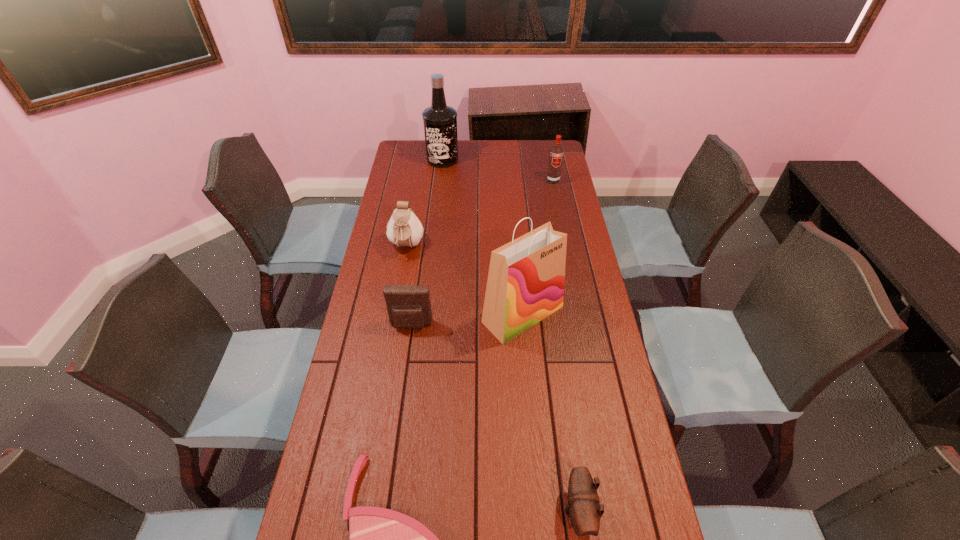
The height and width of the screenshot is (540, 960). Identify the location of vacant space at the far right corner of the desktop. (542, 164).

You are a GUI agent. You are given a task and a screenshot of the screen. Output one action in this format:
    pyautogui.click(x=<x>, y=<y>)
    Task: Click on the free space between the farthest object and the second nearest pouch
    The width and height of the screenshot is (960, 540).
    Given the screenshot: What is the action you would take?
    pyautogui.click(x=427, y=242)

Locate an element on the screen. empty location between the third farthest object and the sixth nearest object is located at coordinates (480, 213).

Identify the location of free space between the shopping bag and the farthest object. (483, 237).

Image resolution: width=960 pixels, height=540 pixels. What are the coordinates of `vacant area between the shopping bag and the third farthest object` in the screenshot? It's located at (465, 280).

Locate which object is the sixth closest to the shopping bag. Please provide its 2D coordinates. Your answer should be formatted as a tuple, i.e. [(x, y)], where the tuple contains the x and y coordinates of a point satisfying the conditions above.

[(440, 121)]

Select which object is the third closest to the sixth nearest object. Please provide its 2D coordinates. Your answer should be formatted as a tuple, i.e. [(x, y)], where the tuple contains the x and y coordinates of a point satisfying the conditions above.

[(525, 284)]

The height and width of the screenshot is (540, 960). I want to click on the closest pouch relative to the shopping bag, so click(x=408, y=306).

The width and height of the screenshot is (960, 540). I want to click on the second closest pouch to the fifth nearest object, so click(x=583, y=504).

Where is `free space that satisfies the following two spatial constraints: 1. on the front-facing side of the farthest pouch; 2. on the right side of the shopping bag`? This screenshot has width=960, height=540. free space that satisfies the following two spatial constraints: 1. on the front-facing side of the farthest pouch; 2. on the right side of the shopping bag is located at coordinates (395, 314).